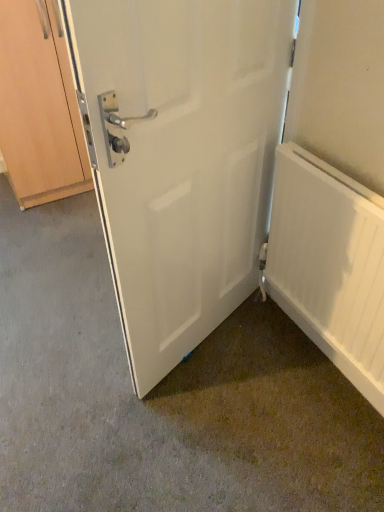
Question: Is white matte radiator at right shorter than white matte door at center?

Choices:
 (A) no
 (B) yes

Answer: (B)

Question: Does white matte radiator at right lie behind white matte door at center?

Choices:
 (A) no
 (B) yes

Answer: (B)

Question: Is white matte radiator at right looking in the opposite direction of white matte door at center?

Choices:
 (A) no
 (B) yes

Answer: (A)

Question: Is white matte radiator at right in front of white matte door at center?

Choices:
 (A) yes
 (B) no

Answer: (B)

Question: Is white matte radiator at right positioned far away from white matte door at center?

Choices:
 (A) yes
 (B) no

Answer: (B)

Question: Does point (235, 31) appear closer or farther from the camera than point (355, 357)?

Choices:
 (A) farther
 (B) closer

Answer: (B)

Question: Considering the positions of white matte door at center and white matte radiator at right in the image, is white matte door at center bigger or smaller than white matte radiator at right?

Choices:
 (A) big
 (B) small

Answer: (A)

Question: From a real-world perspective, relative to white matte radiator at right, is white matte door at center vertically above or below?

Choices:
 (A) above
 (B) below

Answer: (A)

Question: Do you think white matte door at center is within white matte radiator at right, or outside of it?

Choices:
 (A) outside
 (B) inside

Answer: (A)

Question: Considering their positions, is wooden cabinet at left located in front of or behind white matte door at center?

Choices:
 (A) behind
 (B) front

Answer: (A)

Question: Is wooden cabinet at left inside the boundaries of white matte door at center, or outside?

Choices:
 (A) outside
 (B) inside

Answer: (A)

Question: Would you say wooden cabinet at left is to the left or to the right of white matte door at center in the picture?

Choices:
 (A) right
 (B) left

Answer: (B)

Question: Looking at their shapes, would you say wooden cabinet at left is wider or thinner than white matte door at center?

Choices:
 (A) wide
 (B) thin

Answer: (A)

Question: Would you say white matte radiator at right is to the left or to the right of white matte door at center in the picture?

Choices:
 (A) right
 (B) left

Answer: (A)

Question: From the image's perspective, is white matte radiator at right located above or below white matte door at center?

Choices:
 (A) below
 (B) above

Answer: (A)